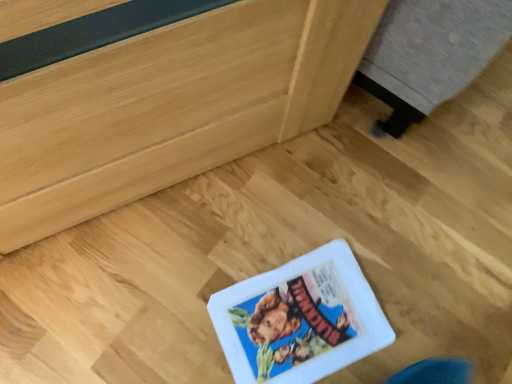
What do you see at coordinates (300, 319) in the screenshot? The width and height of the screenshot is (512, 384). I see `white glossy book at center` at bounding box center [300, 319].

You are a GUI agent. You are given a task and a screenshot of the screen. Output one action in this format:
    pyautogui.click(x=<x>, y=<y>)
    Task: Click on the white glossy book at center
    This screenshot has height=384, width=512.
    Given the screenshot: What is the action you would take?
    pyautogui.click(x=300, y=319)

This screenshot has height=384, width=512. I want to click on white glossy book at center, so click(x=300, y=319).